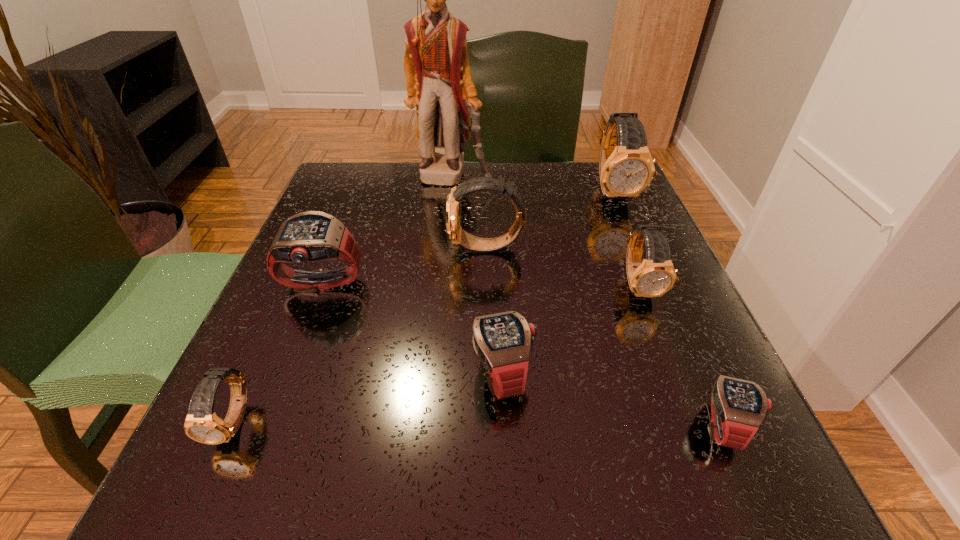
You are a GUI agent. You are given a task and a screenshot of the screen. Output one action in this format:
    pyautogui.click(x=<x>, y=<y>)
    Task: Click on the vacant region at the left edge of the desktop
    The height and width of the screenshot is (540, 960).
    Given the screenshot: What is the action you would take?
    pyautogui.click(x=256, y=437)

The image size is (960, 540). Find the location of `vacant area at the right edge`. vacant area at the right edge is located at coordinates (659, 394).

Find the location of a particular element. The width and height of the screenshot is (960, 540). free region at the far left corner of the desktop is located at coordinates (364, 165).

In the image, there is a desktop. Where is `free space at the far right corner`? The height and width of the screenshot is (540, 960). free space at the far right corner is located at coordinates click(x=606, y=199).

The image size is (960, 540). Find the location of `free region at the near right corner of the desktop`. free region at the near right corner of the desktop is located at coordinates (649, 444).

This screenshot has height=540, width=960. Identify the location of free space that is in between the farthest red watch and the second red watch from right to left. (412, 329).

Locate an element on the screen. The width and height of the screenshot is (960, 540). unoccupied position between the second red watch from right to left and the farthest red watch is located at coordinates (412, 329).

Where is `free space between the second red watch from right to left and the second biggest gold watch`? free space between the second red watch from right to left and the second biggest gold watch is located at coordinates (494, 310).

In order to click on vacant area between the shortest watch and the second smallest red watch in this screenshot , I will do `click(613, 400)`.

What are the coordinates of `vacant space in between the sixth nearest watch and the leftmost red watch` in the screenshot? It's located at (404, 266).